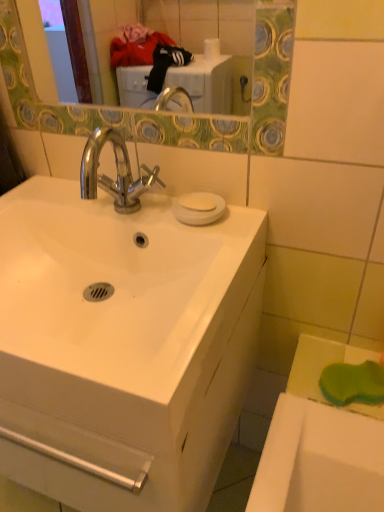
At what (x,y) coordinates should I click in order to perform the action: click on vacant area situated to the left side of white matte soap at upper center. Please return your answer as a coordinate pair (x, y). The image size is (384, 512). Looking at the image, I should click on (143, 206).